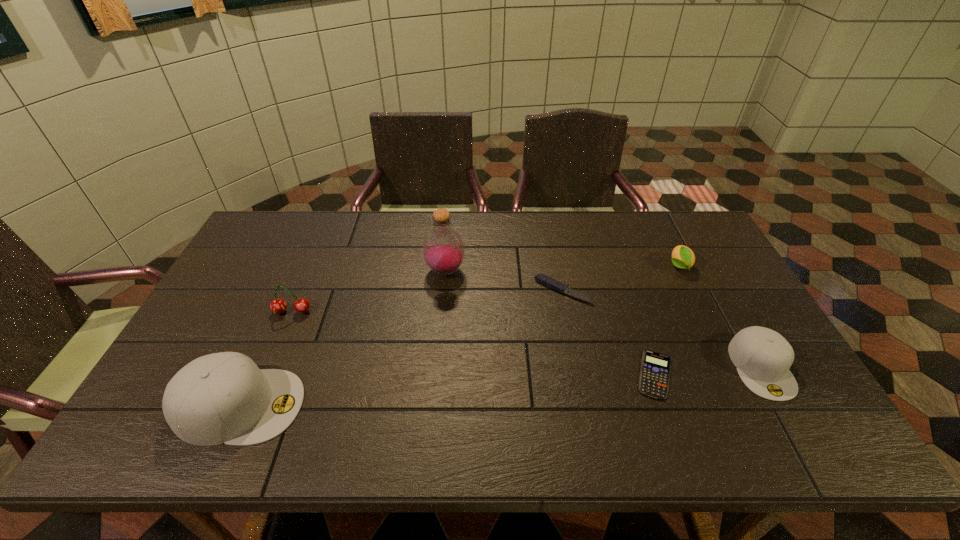
Please determine a free point for an extra cap_(headwear) to ensure balance. Please provide its 2D coordinates. Your answer should be formatted as a tuple, i.e. [(x, y)], where the tuple contains the x and y coordinates of a point satisfying the conditions above.

[(510, 386)]